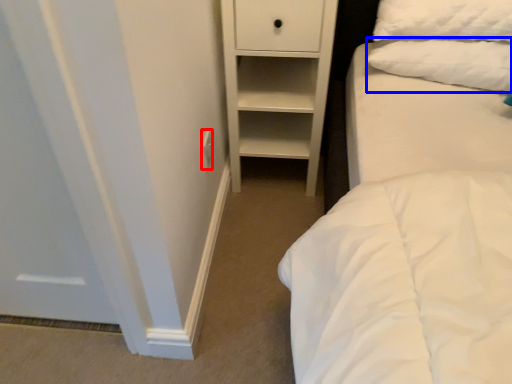
Question: Which of the following is the closest to the observer, electric outlet (highlighted by a red box) or pillow (highlighted by a blue box)?

Choices:
 (A) electric outlet
 (B) pillow

Answer: (B)